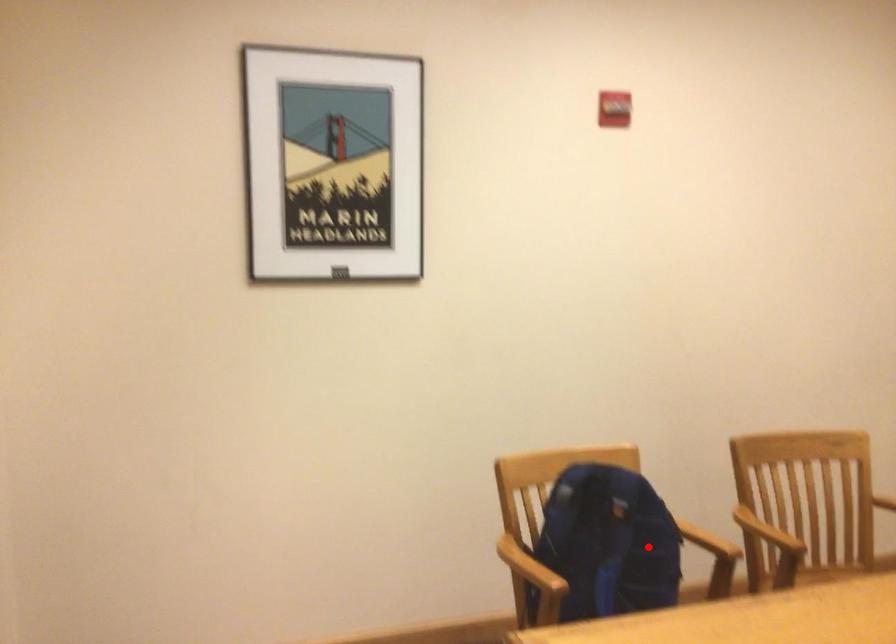
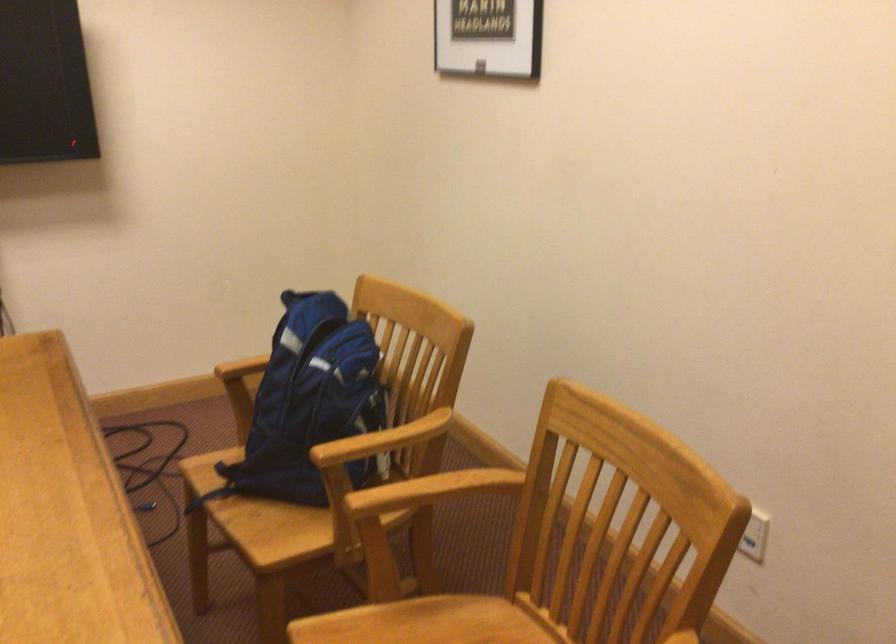
Question: I am providing you with two images of the same scene from different viewpoints. Image1 has a red point marked. In image2, the corresponding 3D location appears at what relative position? Reply with the corresponding letter.

Choices:
 (A) Closer
 (B) Farther

Answer: (A)